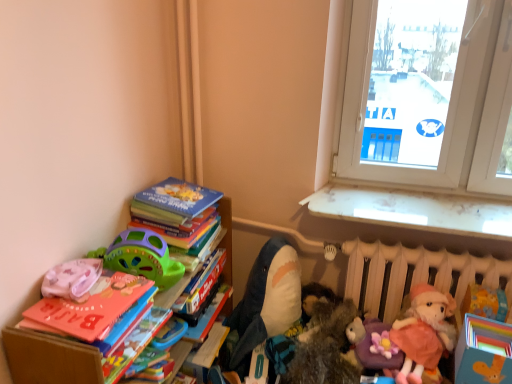
Question: Does pink fabric pillow at left, which is counted as the 6th toy, starting from the right, come behind soft plush shark at center, which is counted as the 3th toy, starting from the left?

Choices:
 (A) no
 (B) yes

Answer: (A)

Question: Considering the relative sizes of pink fabric pillow at left, which is the 1th toy in left-to-right order, and soft plush shark at center, which is counted as the 3th toy, starting from the left, in the image provided, is pink fabric pillow at left, which is the 1th toy in left-to-right order, wider than soft plush shark at center, which is counted as the 3th toy, starting from the left,?

Choices:
 (A) yes
 (B) no

Answer: (B)

Question: Considering the relative sizes of pink fabric pillow at left, which is the 1th toy in left-to-right order, and soft plush shark at center, the 4th toy positioned from the right, in the image provided, is pink fabric pillow at left, which is the 1th toy in left-to-right order, bigger than soft plush shark at center, the 4th toy positioned from the right,?

Choices:
 (A) no
 (B) yes

Answer: (A)

Question: From a real-world perspective, is pink fabric pillow at left, which is the 1th toy in left-to-right order, under soft plush shark at center, the 4th toy positioned from the right?

Choices:
 (A) no
 (B) yes

Answer: (A)

Question: Is the depth of pink fabric pillow at left, which is counted as the 6th toy, starting from the right, less than that of soft plush shark at center, the 4th toy positioned from the right?

Choices:
 (A) yes
 (B) no

Answer: (A)

Question: Does point (74, 294) appear closer or farther from the camera than point (374, 329)?

Choices:
 (A) closer
 (B) farther

Answer: (A)

Question: Considering the relative positions of pink fabric pillow at left, which is counted as the 6th toy, starting from the right, and purple plush toy at lower right, acting as the 5th toy starting from the left, in the image provided, is pink fabric pillow at left, which is counted as the 6th toy, starting from the right, to the left or to the right of purple plush toy at lower right, acting as the 5th toy starting from the left,?

Choices:
 (A) right
 (B) left

Answer: (B)

Question: From the image's perspective, is pink fabric pillow at left, which is counted as the 6th toy, starting from the right, located above or below purple plush toy at lower right, the 2th toy viewed from the right?

Choices:
 (A) above
 (B) below

Answer: (A)

Question: Considering the positions of pink fabric pillow at left, which is counted as the 6th toy, starting from the right, and purple plush toy at lower right, the 2th toy viewed from the right, in the image, is pink fabric pillow at left, which is counted as the 6th toy, starting from the right, wider or thinner than purple plush toy at lower right, the 2th toy viewed from the right,?

Choices:
 (A) wide
 (B) thin

Answer: (B)

Question: Considering the positions of point (474, 216) and point (87, 289), is point (474, 216) closer or farther from the camera than point (87, 289)?

Choices:
 (A) farther
 (B) closer

Answer: (A)

Question: From their relative heights in the image, would you say white glossy window sill at upper right is taller or shorter than pink fabric pillow at left, which is counted as the 6th toy, starting from the right?

Choices:
 (A) short
 (B) tall

Answer: (A)

Question: Is white glossy window sill at upper right inside the boundaries of pink fabric pillow at left, which is counted as the 6th toy, starting from the right, or outside?

Choices:
 (A) outside
 (B) inside

Answer: (A)

Question: Considering the relative positions of white glossy window sill at upper right and pink fabric pillow at left, which is the 1th toy in left-to-right order, in the image provided, is white glossy window sill at upper right to the left or to the right of pink fabric pillow at left, which is the 1th toy in left-to-right order,?

Choices:
 (A) left
 (B) right

Answer: (B)

Question: Considering the relative positions of soft plush shark at center, which is counted as the 3th toy, starting from the left, and pink fabric pillow at left, which is the 1th toy in left-to-right order, in the image provided, is soft plush shark at center, which is counted as the 3th toy, starting from the left, to the left or to the right of pink fabric pillow at left, which is the 1th toy in left-to-right order,?

Choices:
 (A) right
 (B) left

Answer: (A)

Question: From the image's perspective, relative to pink fabric pillow at left, which is counted as the 6th toy, starting from the right, is soft plush shark at center, which is counted as the 3th toy, starting from the left, above or below?

Choices:
 (A) below
 (B) above

Answer: (A)